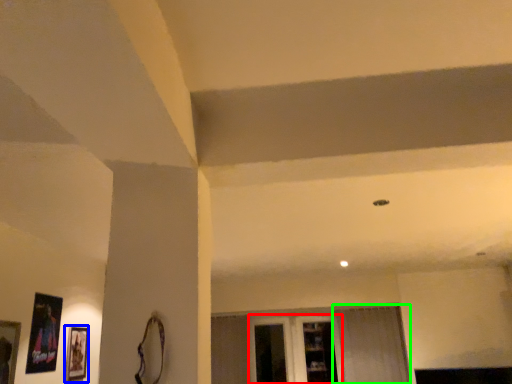
Question: Which object is the closest to the glass door (highlighted by a red box)? Choose among these: picture frame (highlighted by a blue box) or curtain (highlighted by a green box).

Choices:
 (A) picture frame
 (B) curtain

Answer: (B)